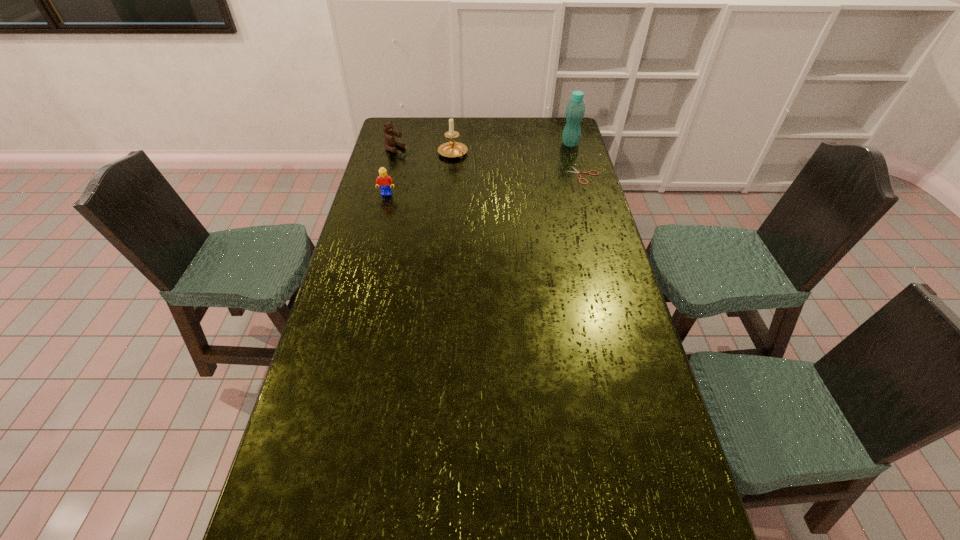
Identify the location of free spot located at the front cap of the water bottle. (556, 153).

This screenshot has height=540, width=960. Find the location of `vacant area situated at the front cap of the water bottle`. vacant area situated at the front cap of the water bottle is located at coordinates (542, 161).

At what (x,y) coordinates should I click in order to perform the action: click on vacant space located with a handle on the side of the fourth shortest object. Please return your answer as a coordinate pair (x, y). Image resolution: width=960 pixels, height=540 pixels. Looking at the image, I should click on (497, 187).

Where is `free space located with a handle on the side of the fourth shortest object`? free space located with a handle on the side of the fourth shortest object is located at coordinates (503, 192).

What are the coordinates of `vacant space located 0.100m with a handle on the side of the fourth shortest object` in the screenshot? It's located at (474, 170).

Where is `vacant space located 0.050m on the face of the teddy bear`? This screenshot has width=960, height=540. vacant space located 0.050m on the face of the teddy bear is located at coordinates 410,156.

Image resolution: width=960 pixels, height=540 pixels. What are the coordinates of `vacant region located 0.060m on the face of the teddy bear` in the screenshot? It's located at (412, 157).

At what (x,y) coordinates should I click in order to perform the action: click on vacant space located 0.210m on the face of the teddy bear. Please return your answer as a coordinate pair (x, y). Looking at the image, I should click on (436, 168).

The width and height of the screenshot is (960, 540). In order to click on object that is at the far edge in this screenshot , I will do `click(575, 110)`.

The width and height of the screenshot is (960, 540). Find the location of `Lego that is at the left edge`. Lego that is at the left edge is located at coordinates (385, 182).